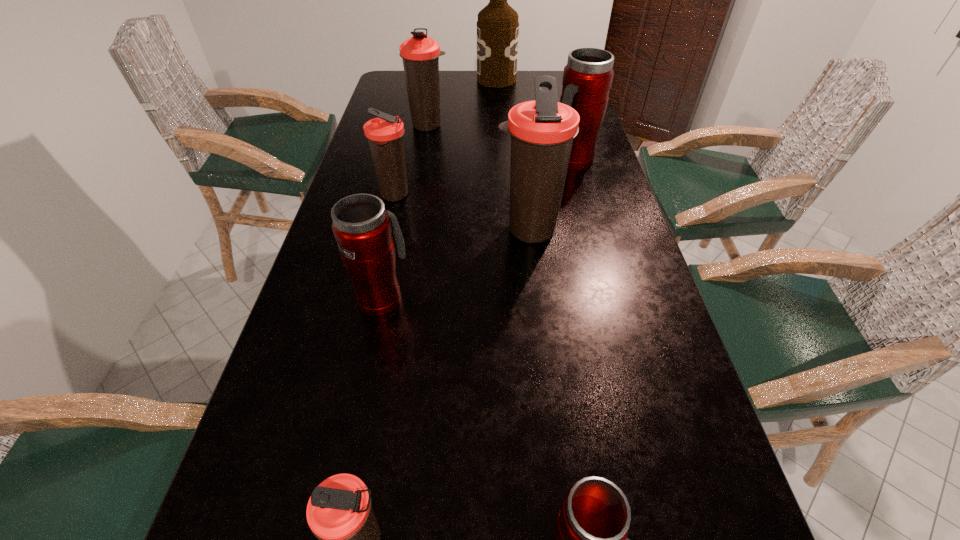
I want to click on vacant region located on the side with the handle of the second farthest red thermos bottle, so click(394, 239).

Identify the location of blank space located 0.150m on the side with the handle of the second farthest red thermos bottle. This screenshot has width=960, height=540. (396, 233).

Where is `object that is at the far edge`? The image size is (960, 540). object that is at the far edge is located at coordinates (497, 27).

Where is `object that is at the right edge`? The height and width of the screenshot is (540, 960). object that is at the right edge is located at coordinates (587, 78).

Identify the location of free space at the far edge of the desktop. Image resolution: width=960 pixels, height=540 pixels. (476, 87).

In the image, there is a desktop. Where is `vacant space at the left edge`? The image size is (960, 540). vacant space at the left edge is located at coordinates (354, 371).

Find the location of a particular element. This screenshot has width=960, height=540. vacant position at the right edge of the desktop is located at coordinates (598, 227).

You are a GUI agent. You are given a task and a screenshot of the screen. Output one action in this format:
    pyautogui.click(x=<x>, y=<y>)
    Task: Click on the free space at the far left corner of the desktop
    The height and width of the screenshot is (540, 960).
    Given the screenshot: What is the action you would take?
    click(392, 73)

Identify the location of vacant region between the fourth nearest thermos bottle and the fifth farthest thermos bottle. The image size is (960, 540). (455, 264).

You are a GUI agent. You are given a task and a screenshot of the screen. Output one action in this format:
    pyautogui.click(x=<x>, y=<y>)
    Task: Click on the empty location between the brown alcohol and the second smallest brown thermos bottle
    
    Given the screenshot: What is the action you would take?
    pyautogui.click(x=445, y=138)